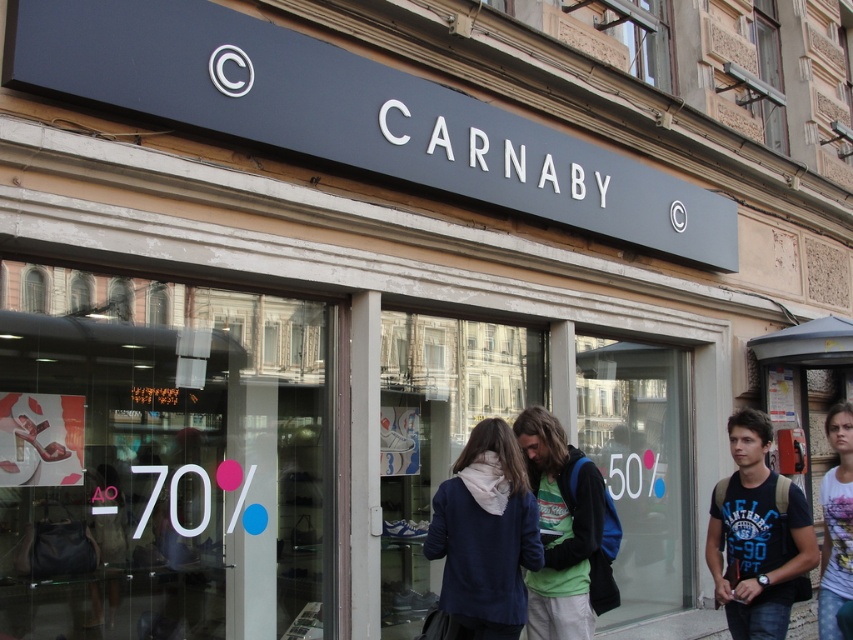
Is green fleece jacket at center to the right of white printed t-shirt at right from the viewer's perspective?

In fact, green fleece jacket at center is to the left of white printed t-shirt at right.

Can you confirm if green fleece jacket at center is shorter than white printed t-shirt at right?

Yes, green fleece jacket at center is shorter than white printed t-shirt at right.

Which is in front, point (596, 500) or point (848, 493)?

Point (596, 500) is more forward.

Find the location of a particular element. green fleece jacket at center is located at coordinates (564, 532).

Which of these two, navy blue sweater at center or green fleece jacket at center, stands taller?

Standing taller between the two is green fleece jacket at center.

Is point (456, 557) positioned before point (577, 554)?

Yes.

The width and height of the screenshot is (853, 640). Identify the location of navy blue sweater at center. [485, 534].

Can you confirm if transparent glass at center is thinner than green fleece jacket at center?

In fact, transparent glass at center might be wider than green fleece jacket at center.

Between transparent glass at center and green fleece jacket at center, which one has more height?

Standing taller between the two is transparent glass at center.

Is point (457, 444) positioned in front of point (560, 481)?

That is False.

The width and height of the screenshot is (853, 640). Find the location of `transparent glass at center`. transparent glass at center is located at coordinates (439, 432).